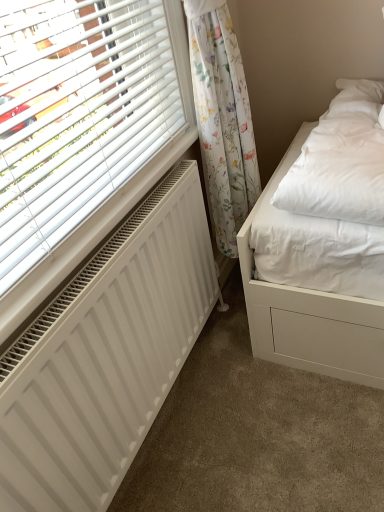
The width and height of the screenshot is (384, 512). I want to click on vacant region to the right of white matte radiator at lower left, so click(x=262, y=412).